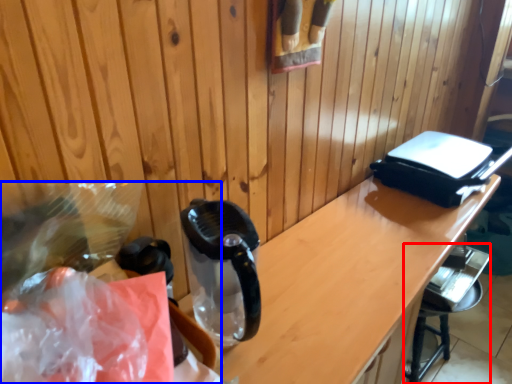
Question: Which object appears farthest to the camera in this image, bar stool (highlighted by a red box) or waste (highlighted by a blue box)?

Choices:
 (A) bar stool
 (B) waste

Answer: (A)